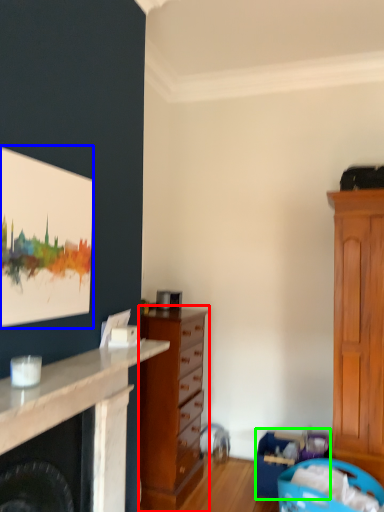
Question: Which is nearer to the chest of drawers (highlighted by a red box)? picture frame (highlighted by a blue box) or laundry basket (highlighted by a green box).

Choices:
 (A) picture frame
 (B) laundry basket

Answer: (B)